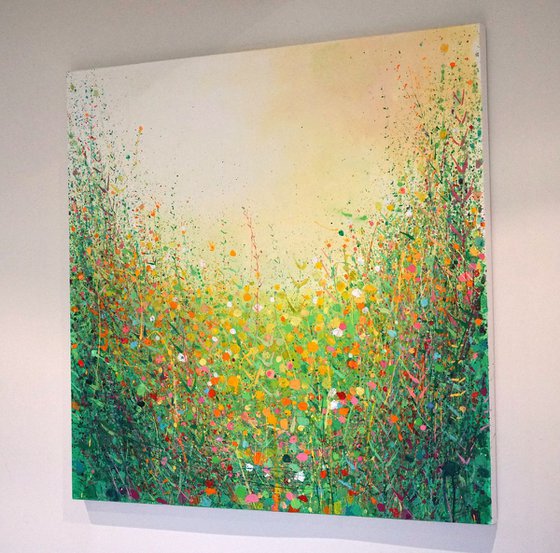
Where is `shadow from painting`? This screenshot has height=553, width=560. shadow from painting is located at coordinates (322, 526).